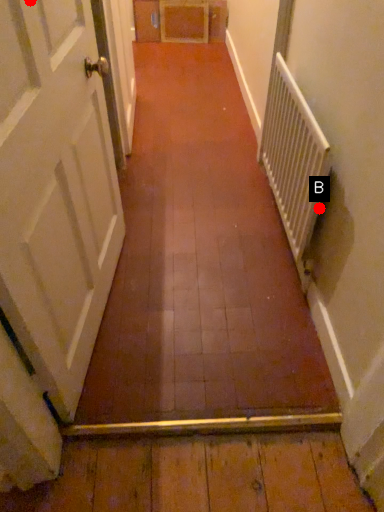
Question: Two points are circled on the image, labeled by A and B beside each circle. Among these points, which one is farthest from the camera?

Choices:
 (A) A is further
 (B) B is further

Answer: (B)